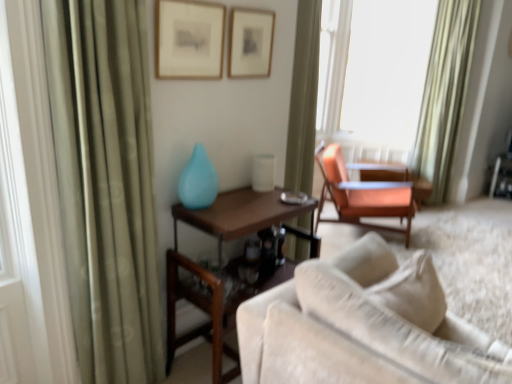
Question: Is green fabric curtain at left, which is the 2th curtain in right-to-left order, bigger or smaller than green satin curtain at upper right, the 2th curtain in the front-to-back sequence?

Choices:
 (A) big
 (B) small

Answer: (B)

Question: Is green fabric curtain at left, the first curtain positioned from the left, situated inside green satin curtain at upper right, the 2th curtain in the front-to-back sequence, or outside?

Choices:
 (A) outside
 (B) inside

Answer: (A)

Question: Considering the real-world distances, which object is closest to the matte orange table at right, the 1th table positioned from the back?

Choices:
 (A) green fabric curtain at left, which is the 2th curtain in right-to-left order
 (B) beige fabric couch at lower right
 (C) white glossy table lamp at center
 (D) matte gold picture frame at upper center, the first picture frame when ordered from back to front
 (E) matte glass vase at center

Answer: (C)

Question: Estimate the real-world distances between objects in this image. Which object is farther from the beige fabric couch at lower right?

Choices:
 (A) green fabric curtain at left, which ranks as the first curtain in front-to-back order
 (B) wooden table at center, arranged as the second table when viewed from the back
 (C) matte gold picture frame at upper center, positioned as the second picture frame in left-to-right order
 (D) transparent glass window at upper right
 (E) orange fabric chair at center

Answer: (D)